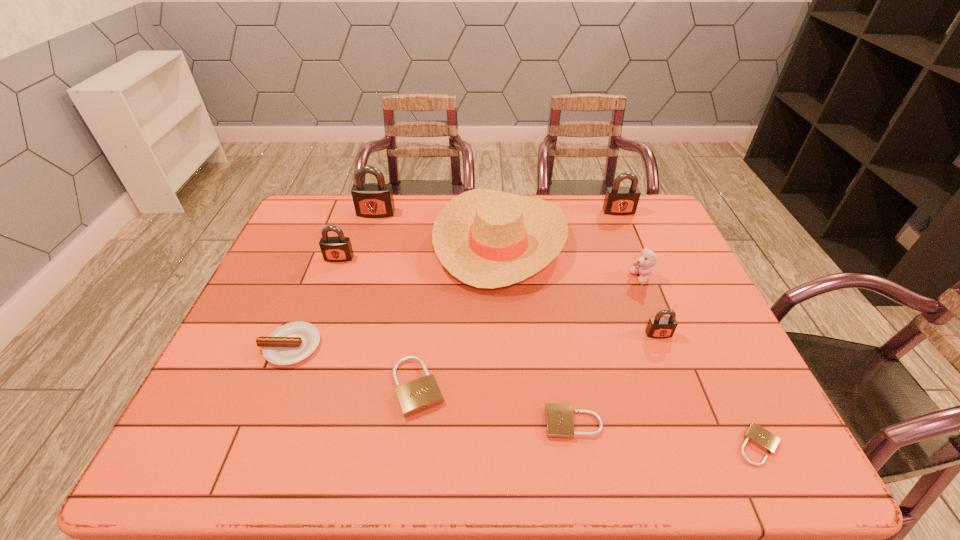
Image resolution: width=960 pixels, height=540 pixels. In order to click on the biggest gray padlock in this screenshot , I will do `click(371, 200)`.

At what (x,y) coordinates should I click in order to perform the action: click on the tallest padlock. Please return your answer as a coordinate pair (x, y). The height and width of the screenshot is (540, 960). Looking at the image, I should click on (x=371, y=200).

Locate an element on the screen. The width and height of the screenshot is (960, 540). the second biggest gray padlock is located at coordinates (620, 201).

Locate an element on the screen. the sixth shortest padlock is located at coordinates (620, 201).

You are a GUI agent. You are given a task and a screenshot of the screen. Output one action in this format:
    pyautogui.click(x=<x>, y=<y>)
    Task: Click on the sunhat
    The image size is (960, 540).
    Given the screenshot: What is the action you would take?
    pyautogui.click(x=486, y=238)

Image resolution: width=960 pixels, height=540 pixels. I want to click on the fifth shortest padlock, so click(338, 248).

Image resolution: width=960 pixels, height=540 pixels. Find the location of `the third biggest gray padlock`. the third biggest gray padlock is located at coordinates (338, 248).

You are a GUI agent. You are given a task and a screenshot of the screen. Output one action in this format:
    pyautogui.click(x=<x>, y=<y>)
    Task: Click on the pink teddy bear
    This screenshot has height=540, width=960.
    Given the screenshot: What is the action you would take?
    pyautogui.click(x=643, y=266)

Identify the location of the smallest gray padlock. The height and width of the screenshot is (540, 960). point(660,327).

Find the location of a particular element. This screenshot has height=540, width=960. the fourth farthest padlock is located at coordinates (660, 327).